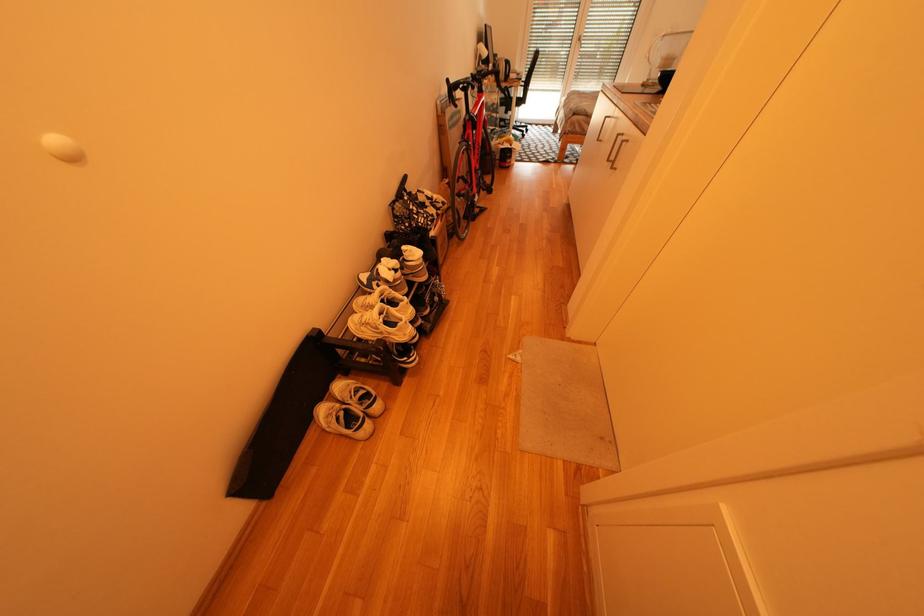
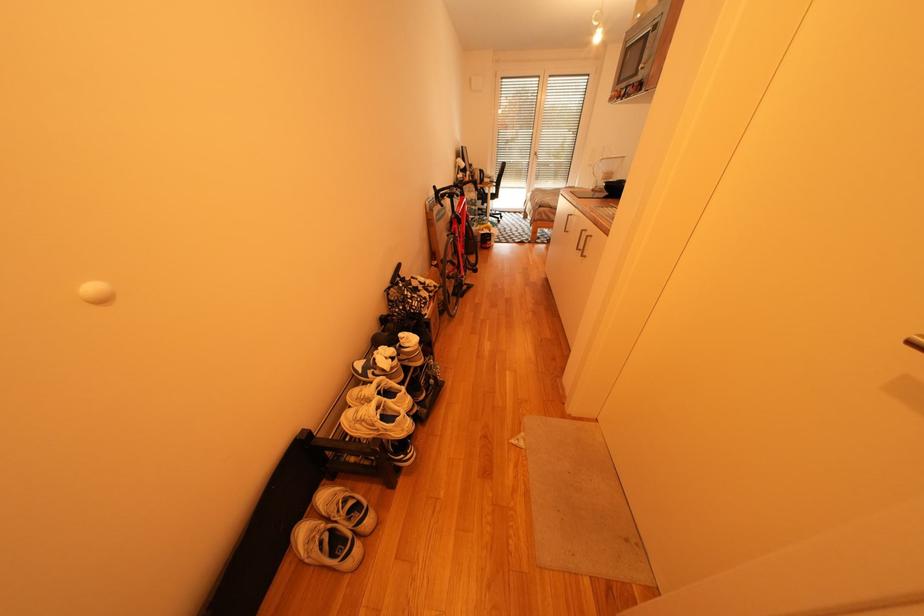
Question: The first image is from the beginning of the video and the second image is from the end. How did the camera likely rotate when shooting the video?

Choices:
 (A) Left
 (B) Right
 (C) Up
 (D) Down

Answer: (C)